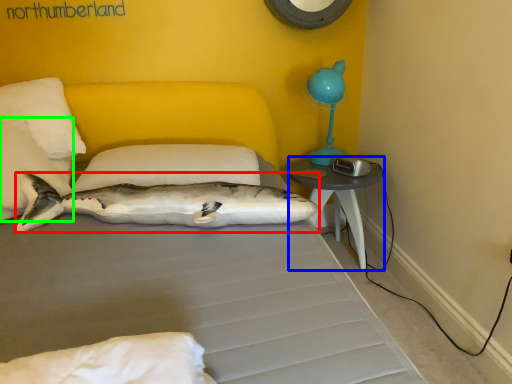
Question: Which object is the closest to the shark (highlighted by a red box)? Choose among these: nightstand (highlighted by a blue box) or pillow (highlighted by a green box).

Choices:
 (A) nightstand
 (B) pillow

Answer: (B)